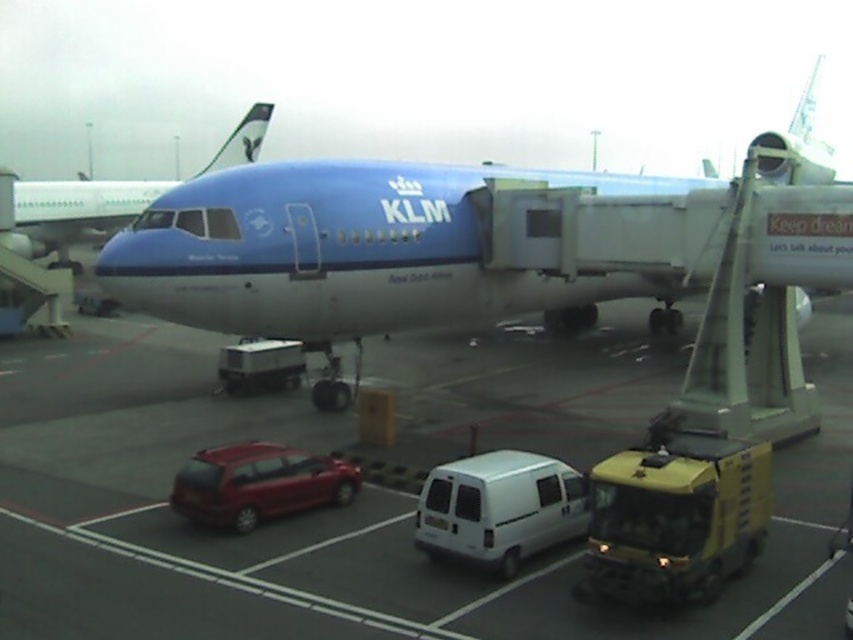
Looking at this image, you are a passenger standing at the jet bridge entrance. You want to find your car, the shiny red hatchback at lower left, after disembarking. Which direction should you walk relative to the blue polished airplane at center?

After disembarking through the jet bridge entrance, you should walk away from the blue polished airplane at center to locate the shiny red hatchback at lower left since the airplane is positioned over it, meaning the car is behind the airplane from your perspective.

You are a passenger waiting to board the KLM Royal Dutch Airlines aircraft. You see the white matte van at center and the shiny red hatchback at lower left in the foreground. Which vehicle is positioned closer to the airplane?

The white matte van at center is positioned closer to the airplane because it is below the shiny red hatchback at lower left, indicating it is situated in front of or nearer to the aircraft.